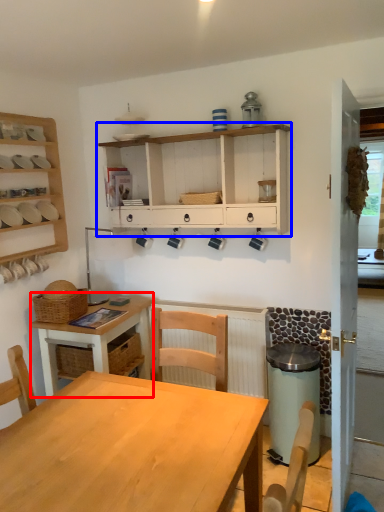
Question: Which object is closer to the camera taking this photo, desk (highlighted by a red box) or shelf (highlighted by a blue box)?

Choices:
 (A) desk
 (B) shelf

Answer: (B)